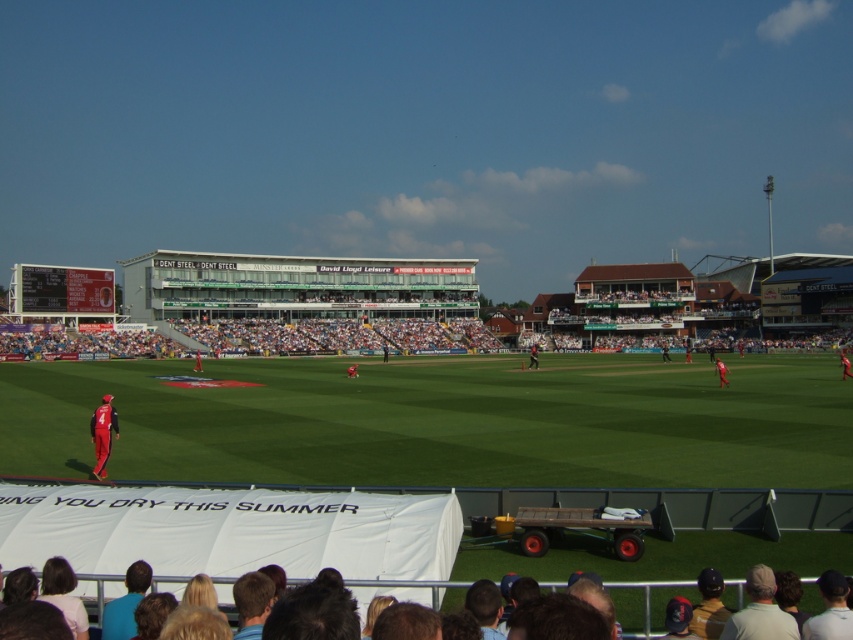
You are a spectator sitting in the stands and want to take a photo of both the blonde hair at lower center and the dark blue helmet at lower right. Which object should you focus on first to ensure both are in the frame?

You should focus on the blonde hair at lower center first since it is closer to the viewer than the dark blue helmet at lower right, allowing you to adjust the camera angle to include both in the frame.

You are standing at the edge of the cricket field and see two points marked in the image. Which point, point (773,634) or point (715,362), is closer to you?

Point (773,634) is closer to the viewer than point (715,362).